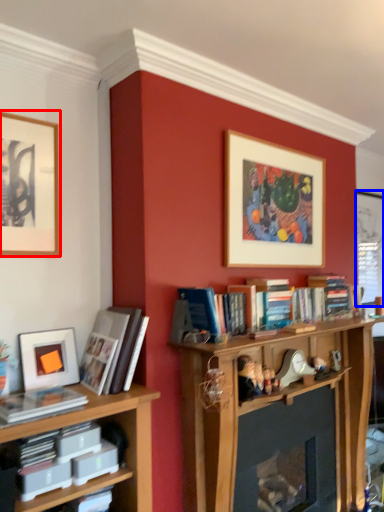
Question: Which of the following is the farthest to the observer, picture frame (highlighted by a red box) or window screen (highlighted by a blue box)?

Choices:
 (A) picture frame
 (B) window screen

Answer: (B)